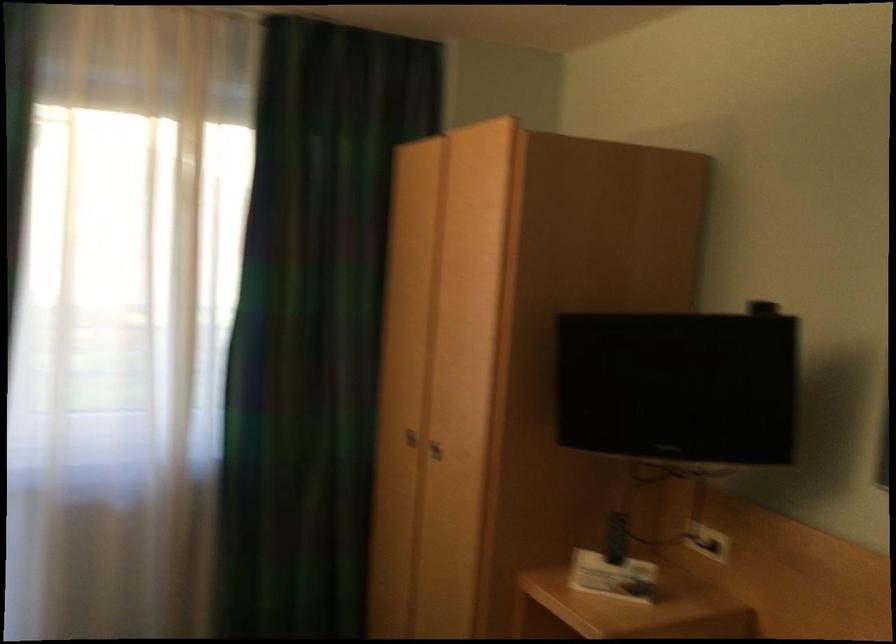
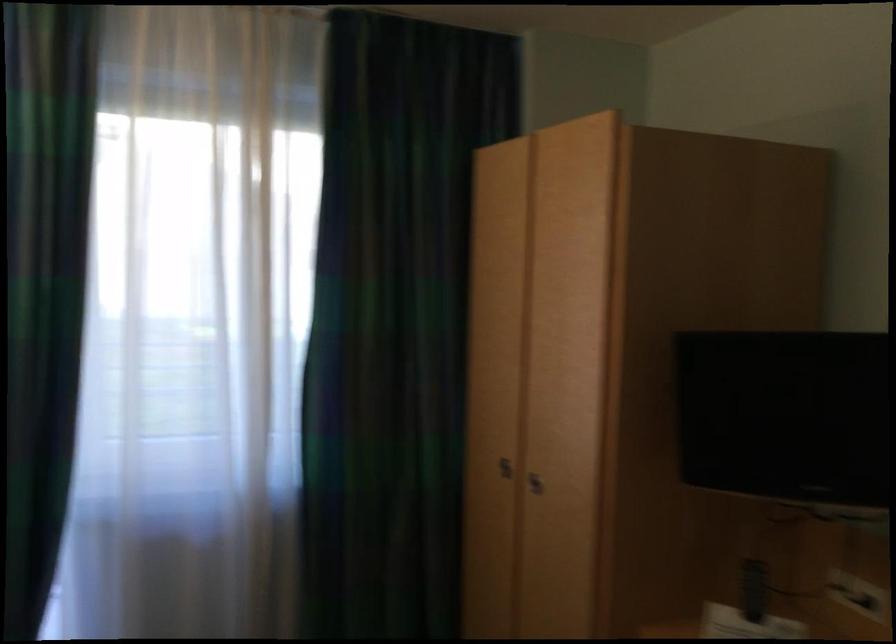
Question: The camera is either moving clockwise (left) or counter-clockwise (right) around the object. The first image is from the beginning of the video and the second image is from the end. Is the camera moving left or right when shooting the video?

Choices:
 (A) Left
 (B) Right

Answer: (B)